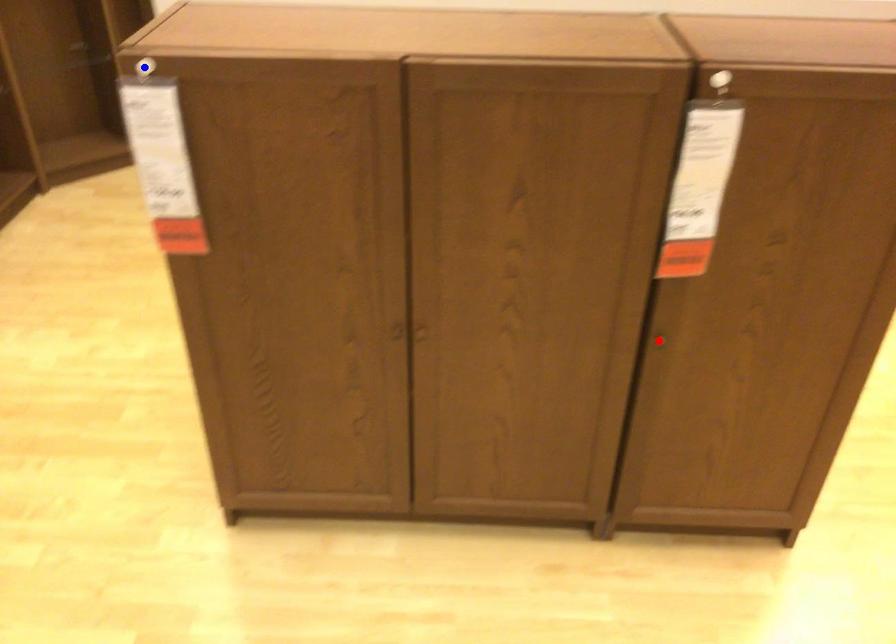
Question: Which of the two points in the image is closer to the camera?

Choices:
 (A) Blue point is closer.
 (B) Red point is closer.

Answer: (A)